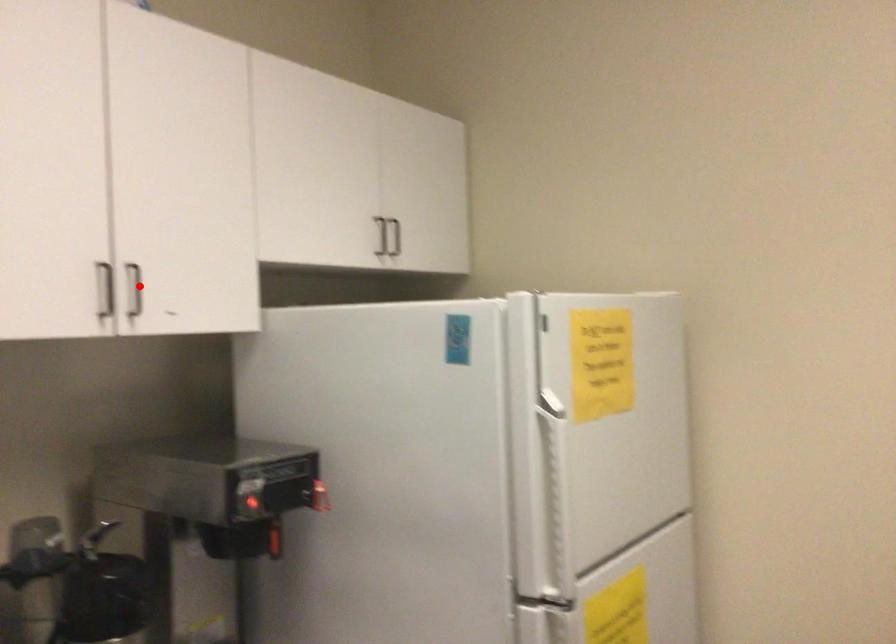
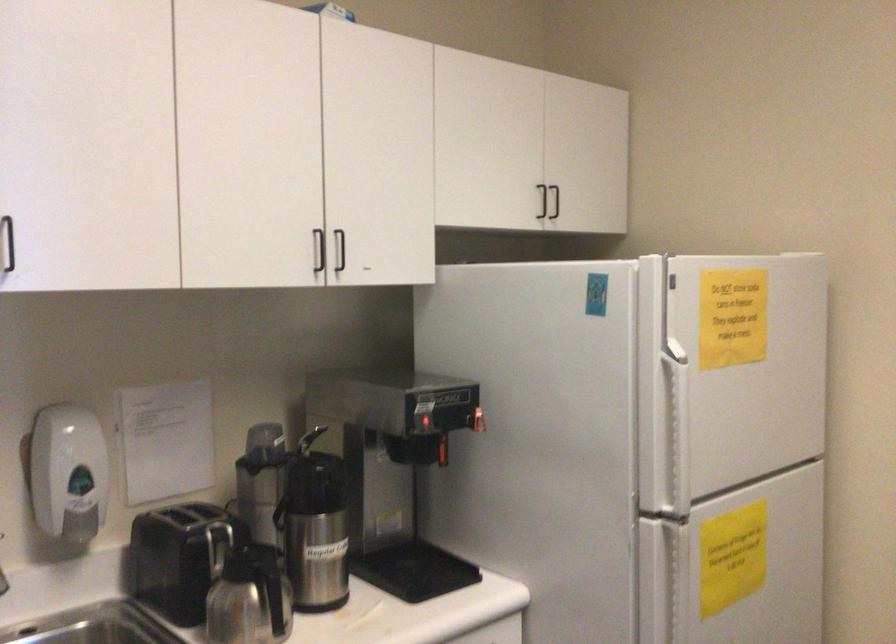
Question: I am providing you with two images of the same scene from different viewpoints. In image1, a red point is highlighted. Considering the same 3D point in image2, which of the following is correct?

Choices:
 (A) It is closer
 (B) It is farther

Answer: (B)